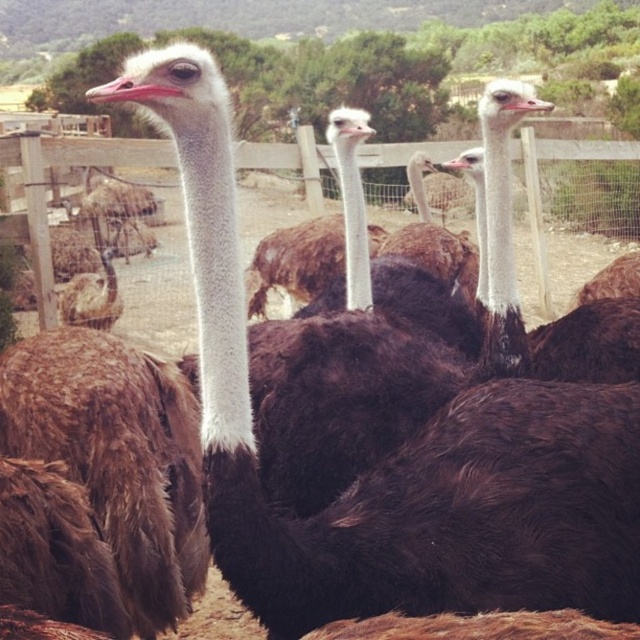
Does wooden fence at center lie behind brown feathered ostrich at center?

No.

Is point (310, 129) positioned before point (266, 243)?

That is False.

At what (x,y) coordinates should I click in order to perform the action: click on wooden fence at center. Please return your answer as a coordinate pair (x, y). The height and width of the screenshot is (640, 640). Looking at the image, I should click on (68, 166).

Does brown fuzzy ostrich at upper right appear on the right side of brown fuzzy ostrich at center?

In fact, brown fuzzy ostrich at upper right is to the left of brown fuzzy ostrich at center.

Consider the image. Does brown fuzzy ostrich at upper right have a lesser width compared to brown fuzzy ostrich at center?

Correct, brown fuzzy ostrich at upper right's width is less than brown fuzzy ostrich at center's.

Image resolution: width=640 pixels, height=640 pixels. What do you see at coordinates (515, 280) in the screenshot?
I see `brown fuzzy ostrich at upper right` at bounding box center [515, 280].

At what (x,y) coordinates should I click in order to perform the action: click on brown fuzzy ostrich at upper right. Please return your answer as a coordinate pair (x, y). Looking at the image, I should click on (515, 280).

Between wooden fence at center and brown fuzzy ostrich at center, which one has less height?

brown fuzzy ostrich at center

Who is higher up, wooden fence at center or brown fuzzy ostrich at center?

Positioned higher is wooden fence at center.

At what (x,y) coordinates should I click in order to perform the action: click on wooden fence at center. Please return your answer as a coordinate pair (x, y). The image size is (640, 640). Looking at the image, I should click on (68, 166).